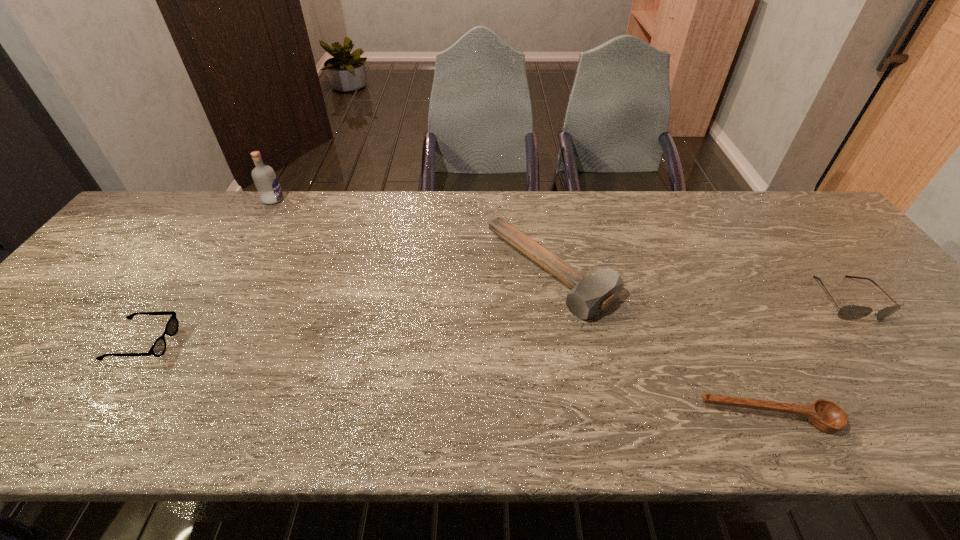
Where is `free space located on the left of the mallet`? This screenshot has width=960, height=540. free space located on the left of the mallet is located at coordinates (352, 271).

Locate an element on the screen. This screenshot has height=540, width=960. vacant area situated 0.090m on the front-facing side of the sunglasses is located at coordinates (890, 354).

At what (x,y) coordinates should I click in order to perform the action: click on vacant position located on the arms of the spectacles. Please return your answer as a coordinate pair (x, y). Looking at the image, I should click on (343, 342).

Where is `vacant space situated 0.200m on the right of the nearest object`? The width and height of the screenshot is (960, 540). vacant space situated 0.200m on the right of the nearest object is located at coordinates (936, 418).

You are a GUI agent. You are given a task and a screenshot of the screen. Output one action in this format:
    pyautogui.click(x=<x>, y=<y>)
    Task: Click on the vodka at the far edge
    The image size is (960, 540).
    Given the screenshot: What is the action you would take?
    pyautogui.click(x=264, y=177)

The height and width of the screenshot is (540, 960). In order to click on mallet present at the far edge in this screenshot , I will do `click(591, 294)`.

Find the location of a particular element. object located in the near edge section of the desktop is located at coordinates (826, 416).

Locate an element on the screen. Image resolution: width=960 pixels, height=540 pixels. object at the right edge is located at coordinates (848, 312).

Identify the location of blank area at the far edge. (238, 228).

Locate an element on the screen. This screenshot has width=960, height=540. free region at the near edge is located at coordinates (778, 438).